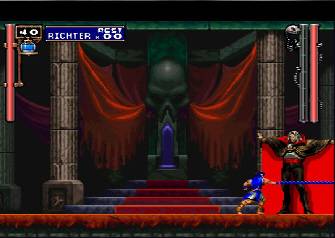
Locate an element on the screen. The width and height of the screenshot is (335, 238). curtains is located at coordinates (116, 103), (222, 106).